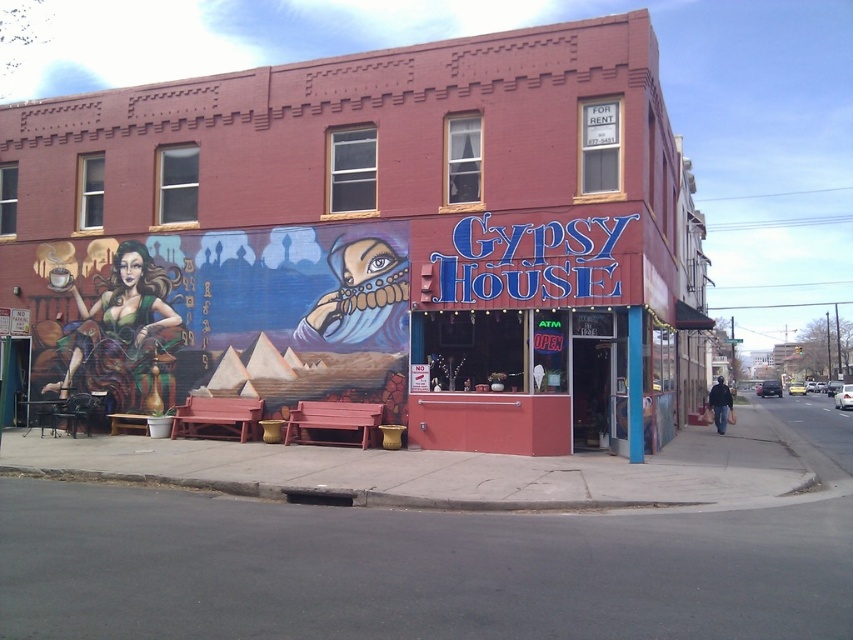
You are a painter standing at the front of the matte brick building at center and the matte black woman at left. You want to paint both objects. Which one requires more horizontal space to cover its entire width?

The matte brick building at center might be wider than the matte black woman at left, so it requires more horizontal space to cover its entire width.

You are a delivery person with a cart that is 20 feet long. You need to navigate through the space between the matte brick building at center and the matte pink counter at center. Can your cart fit through the space between them?

The matte brick building at center and the matte pink counter at center are 18.90 feet apart, which is less than the 20 feet length of the cart. Therefore, the cart cannot fit through the space between them.